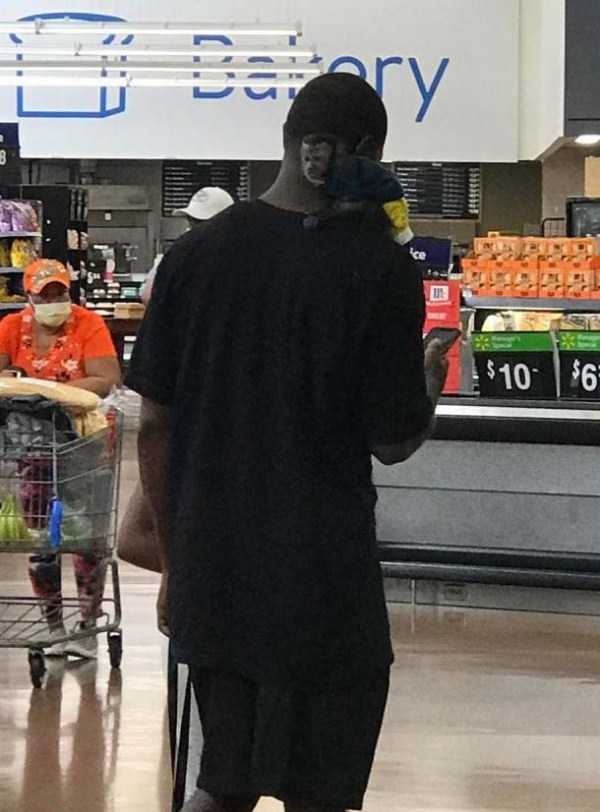
Where is `phone`? The image size is (600, 812). phone is located at coordinates (446, 337).